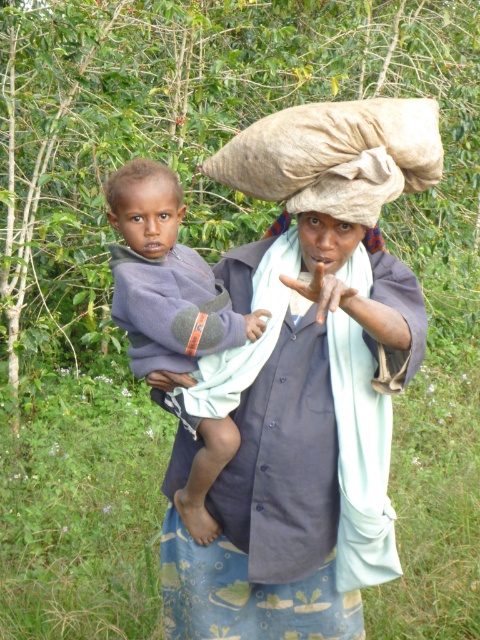
Question: Which is farther from the dark brown skin at center?

Choices:
 (A) dark gray fleece at center
 (B) blue fabric at center

Answer: (B)

Question: Among these points, which one is farthest from the camera?

Choices:
 (A) (131, 180)
 (B) (409, 369)
 (C) (197, 461)

Answer: (C)

Question: Is blue fabric at center further to camera compared to dark gray fleece at center?

Choices:
 (A) yes
 (B) no

Answer: (B)

Question: Is blue fabric at center positioned behind dark gray fleece at center?

Choices:
 (A) yes
 (B) no

Answer: (B)

Question: Can you confirm if dark gray fleece at center is smaller than dark brown skin at center?

Choices:
 (A) no
 (B) yes

Answer: (A)

Question: Among these points, which one is nearest to the camera?

Choices:
 (A) (253, 253)
 (B) (141, 198)
 (C) (119, 216)

Answer: (B)